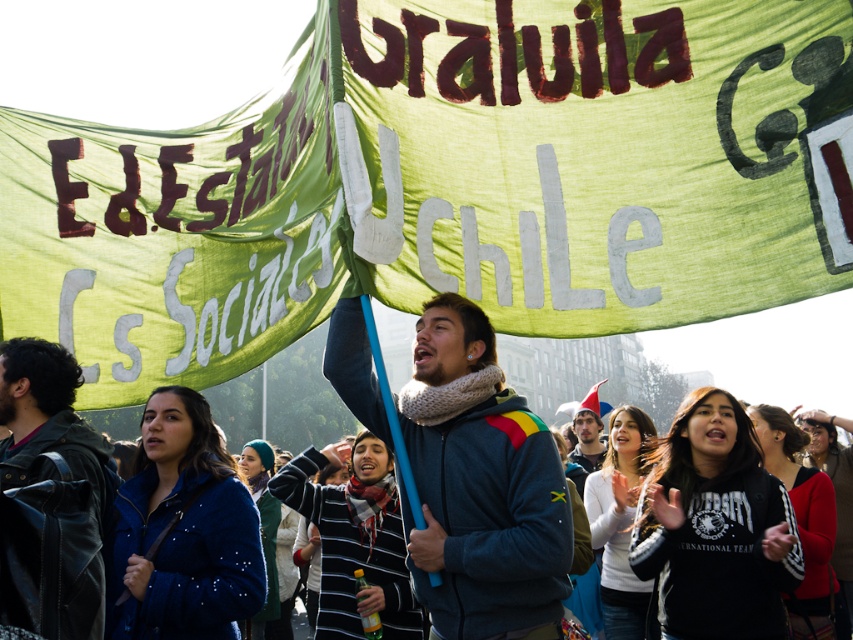
You are a photographer trying to capture the protest scene. You notice two points in the image at coordinates point (469, 124) and point (363, 362). Which point is closer to your camera lens?

Point (469, 124) is closer to the camera lens than point (363, 362).

You are a photographer standing at the edge of the protest crowd. You want to take a photo that includes both the dark gray fleece jacket at center and the dark blue sweater at center. Given that your camera has a maximum focus range of 90 feet, will you be able to capture both subjects in focus simultaneously?

The dark gray fleece jacket at center is 96.47 feet from the dark blue sweater at center. Since your camera can only focus up to 90 feet, the distance between them exceeds the maximum focus range. Therefore, you cannot capture both subjects in focus at the same time.

You are a photographer trying to capture a photo of the protest scene. You notice the dark gray fleece jacket at center and the dark brown leather jacket at lower left. Which jacket should you focus on to ensure it appears larger in your photo?

The dark gray fleece jacket at center appears larger in the photo because it is taller than the dark brown leather jacket at lower left.